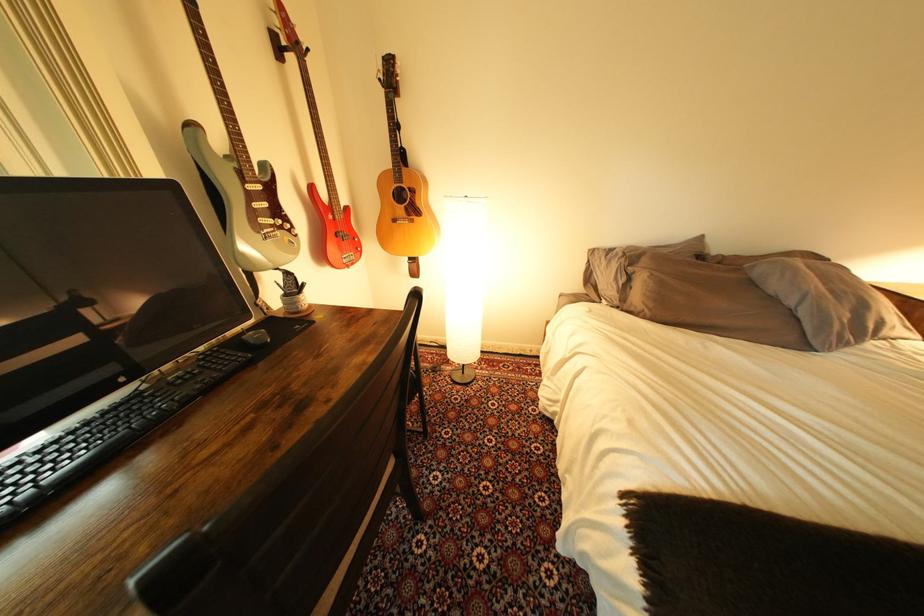
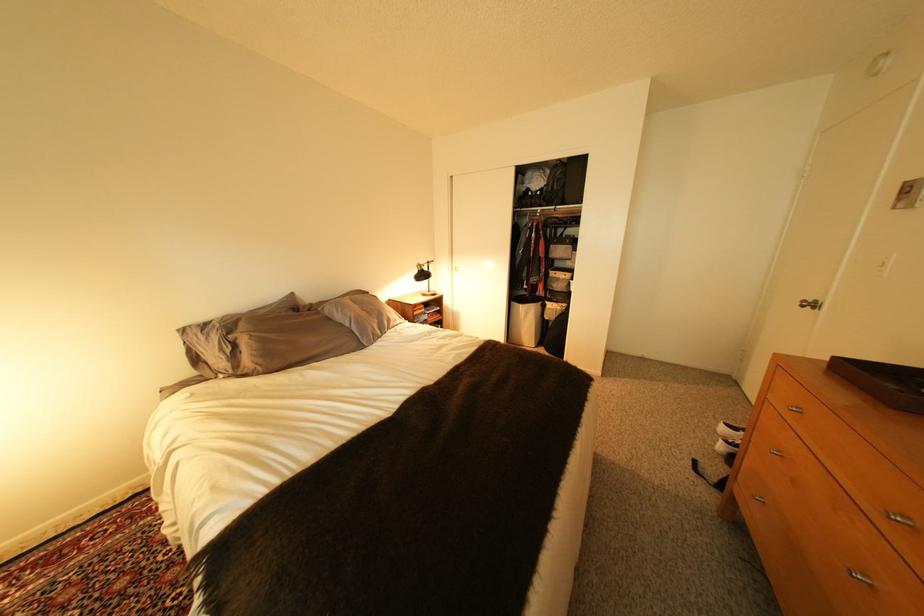
Question: The camera is either moving clockwise (left) or counter-clockwise (right) around the object. The first image is from the beginning of the video and the second image is from the end. Is the camera moving left or right when shooting the video?

Choices:
 (A) Left
 (B) Right

Answer: (A)